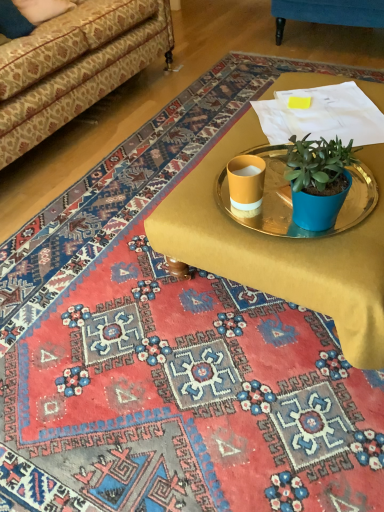
Question: From the image's perspective, is metallic gold tray at center over patterned fabric couch at upper left?

Choices:
 (A) yes
 (B) no

Answer: (B)

Question: Could you tell me if metallic gold tray at center is facing patterned fabric couch at upper left?

Choices:
 (A) no
 (B) yes

Answer: (A)

Question: From a real-world perspective, is metallic gold tray at center on patterned fabric couch at upper left?

Choices:
 (A) no
 (B) yes

Answer: (A)

Question: From the image's perspective, would you say metallic gold tray at center is shown under patterned fabric couch at upper left?

Choices:
 (A) no
 (B) yes

Answer: (B)

Question: Can you confirm if metallic gold tray at center is smaller than patterned fabric couch at upper left?

Choices:
 (A) no
 (B) yes

Answer: (B)

Question: In terms of width, does metallic gold tray at center look wider or thinner when compared to patterned fabric couch at upper left?

Choices:
 (A) thin
 (B) wide

Answer: (A)

Question: Choose the correct answer: Is metallic gold tray at center inside patterned fabric couch at upper left or outside it?

Choices:
 (A) inside
 (B) outside

Answer: (B)

Question: In the image, is metallic gold tray at center positioned in front of or behind patterned fabric couch at upper left?

Choices:
 (A) behind
 (B) front

Answer: (B)

Question: In terms of size, does metallic gold tray at center appear bigger or smaller than patterned fabric couch at upper left?

Choices:
 (A) small
 (B) big

Answer: (A)

Question: Considering their positions, is patterned fabric couch at upper left located in front of or behind matte yellow cup at center?

Choices:
 (A) front
 (B) behind

Answer: (B)

Question: Is patterned fabric couch at upper left taller or shorter than matte yellow cup at center?

Choices:
 (A) short
 (B) tall

Answer: (B)

Question: From the image's perspective, is patterned fabric couch at upper left positioned above or below matte yellow cup at center?

Choices:
 (A) above
 (B) below

Answer: (A)

Question: In terms of width, does patterned fabric couch at upper left look wider or thinner when compared to matte yellow cup at center?

Choices:
 (A) wide
 (B) thin

Answer: (A)

Question: From a real-world perspective, is metallic gold tray at center positioned above or below matte yellow cup at center?

Choices:
 (A) below
 (B) above

Answer: (A)

Question: In terms of height, does metallic gold tray at center look taller or shorter compared to matte yellow cup at center?

Choices:
 (A) tall
 (B) short

Answer: (B)